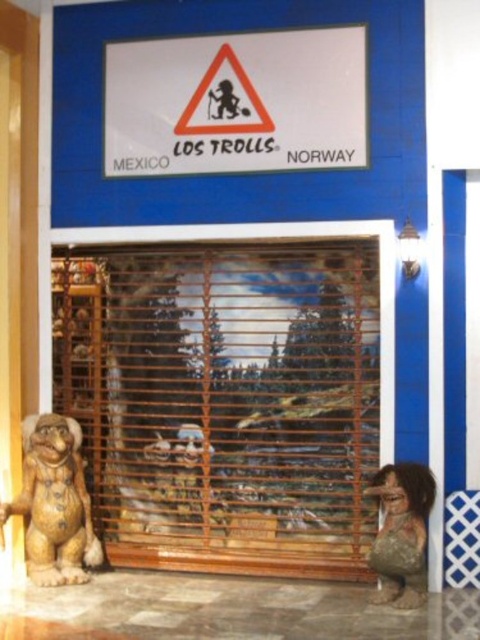
You are standing in front of the store and want to touch both the white paper sign at upper center and the brown wooden figurine at lower left. Which object should you reach for first?

You should reach for the white paper sign at upper center first because it is closer to you than the brown wooden figurine at lower left, which is further away.

You are standing in front of the store and want to touch both points on the facade. Which point should you reach for first, the point at coordinate (340,80) or the point at coordinate (402,570)?

You should reach for the point at coordinate (340,80) first because it is closer to you than the point at coordinate (402,570).